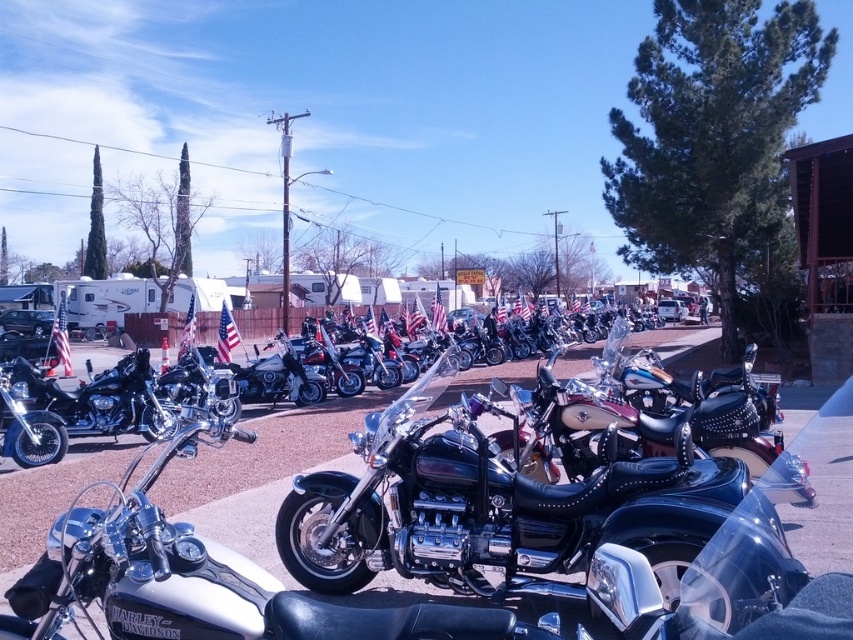
Question: Does polished chrome cruiser at center have a larger size compared to polished chrome motorcycle at center?

Choices:
 (A) no
 (B) yes

Answer: (B)

Question: Does polished chrome cruiser at center have a smaller size compared to polished chrome motorcycle at center?

Choices:
 (A) yes
 (B) no

Answer: (B)

Question: Among these objects, which one is farthest from the camera?

Choices:
 (A) polished chrome motorcycle at center
 (B) polished chrome cruiser at center

Answer: (A)

Question: Which point is farther to the camera?

Choices:
 (A) (541, 564)
 (B) (541, 403)

Answer: (B)

Question: Is polished chrome cruiser at center behind polished chrome motorcycle at center?

Choices:
 (A) no
 (B) yes

Answer: (A)